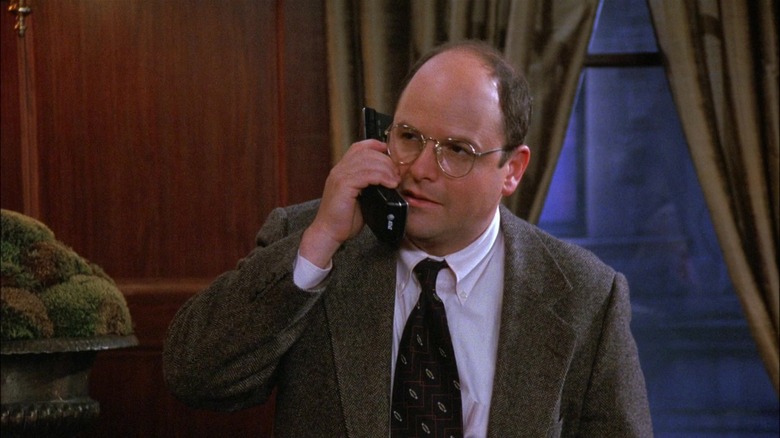
The height and width of the screenshot is (438, 780). In order to click on curtain in this screenshot , I will do `click(704, 89)`, `click(539, 43)`.